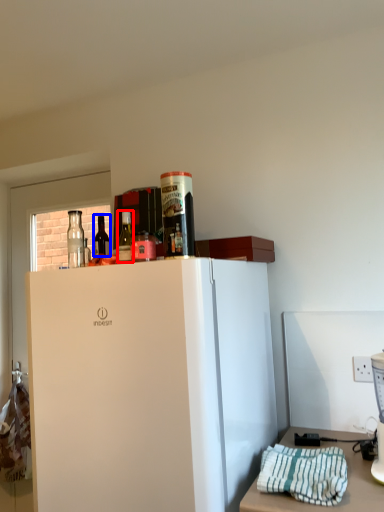
Question: Which of the following is the closest to the observer, bottle (highlighted by a red box) or bottle (highlighted by a blue box)?

Choices:
 (A) bottle
 (B) bottle

Answer: (A)